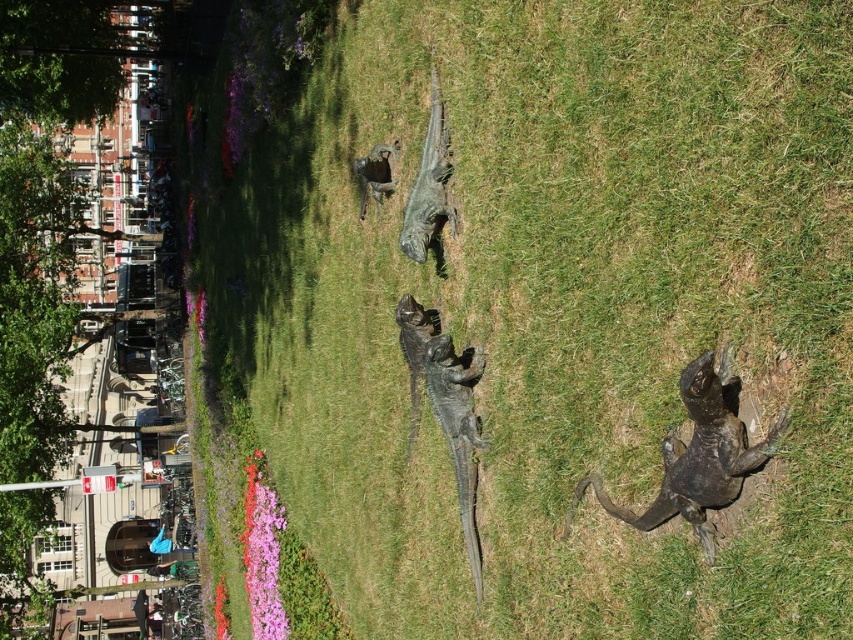
Question: Does shiny black statue at lower right lie in front of bronze statue at center?

Choices:
 (A) no
 (B) yes

Answer: (B)

Question: Estimate the real-world distances between objects in this image. Which object is closer to the shiny black statue at lower right?

Choices:
 (A) shiny black lizard at center
 (B) bronze statue at center

Answer: (A)

Question: Is shiny black statue at lower right above green polished stone dinosaur at center?

Choices:
 (A) yes
 (B) no

Answer: (B)

Question: Which of these objects is positioned farthest from the bronze statue at center?

Choices:
 (A) green polished stone dinosaur at center
 (B) shiny black lizard at center
 (C) shiny black statue at lower right

Answer: (C)

Question: Which object is positioned farthest from the shiny black lizard at center?

Choices:
 (A) shiny black statue at lower right
 (B) bronze statue at center
 (C) green polished stone dinosaur at center

Answer: (A)

Question: Is shiny black lizard at center bigger than bronze statue at center?

Choices:
 (A) no
 (B) yes

Answer: (A)